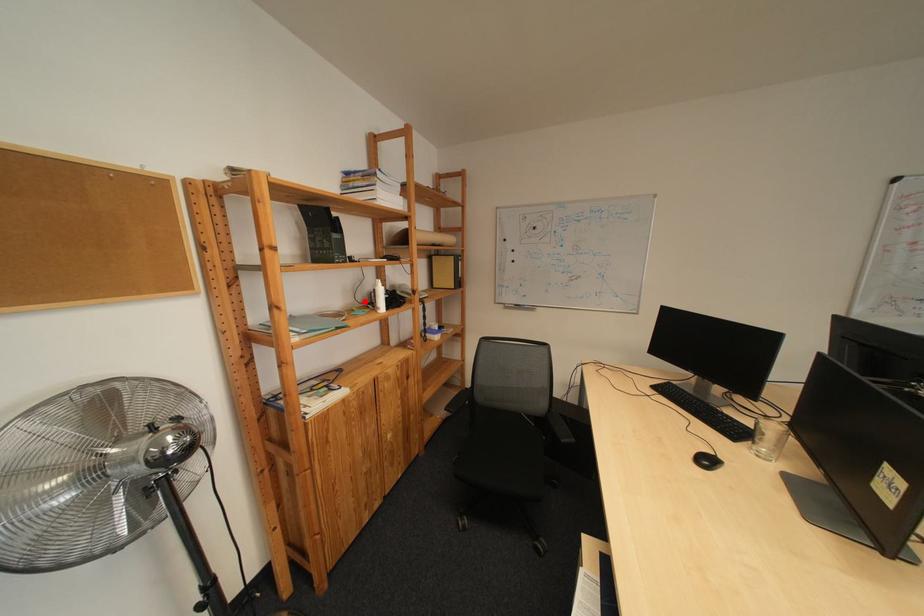
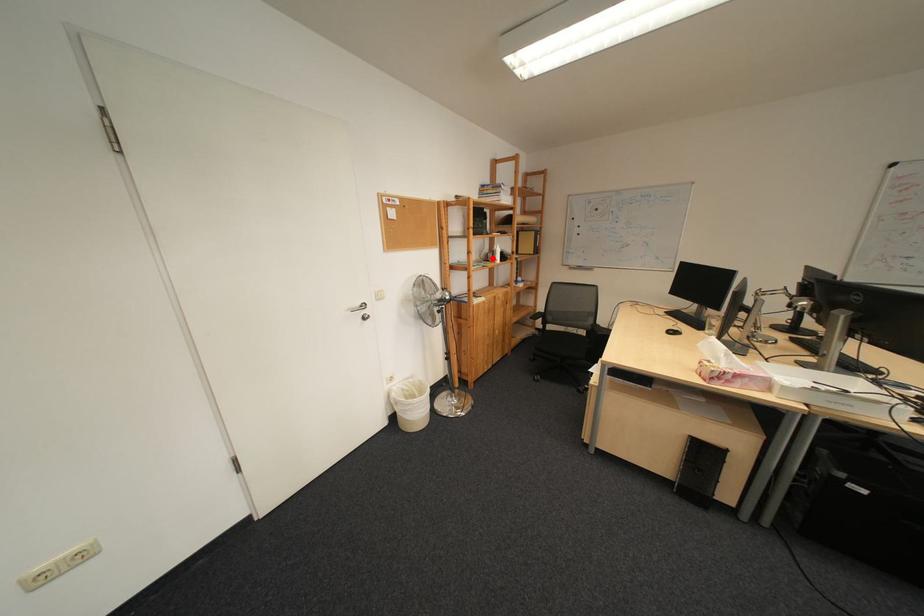
I am providing you with two images of the same scene from different viewpoints. A red point is marked on the first image and another point is marked on the second image. Are the points marked in image1 and image2 representing the same 3D position?

Result: Yes